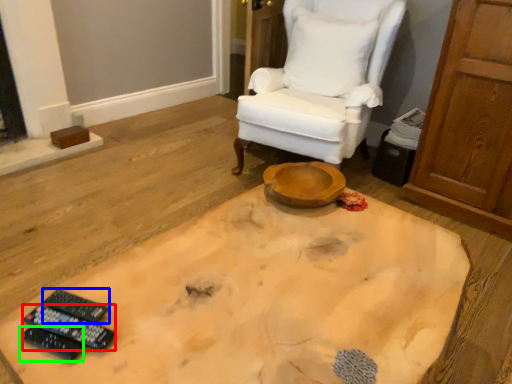
Question: Which object is positioned closest to remote control (highlighted by a red box)? Select from remote control (highlighted by a blue box) and remote control (highlighted by a green box).

Choices:
 (A) remote control
 (B) remote control

Answer: (B)